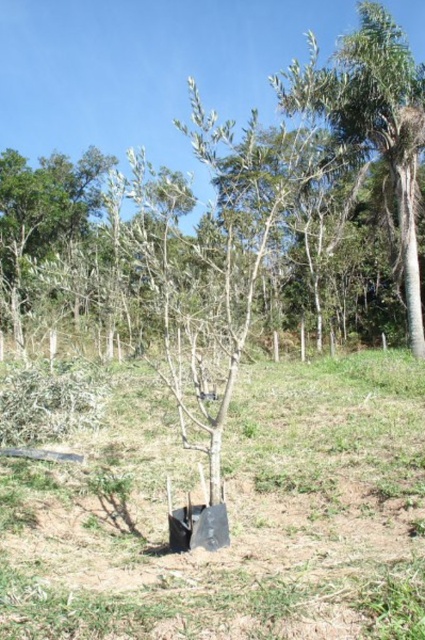
You are a gardener who wants to plant a new flowerbed between the green grass at center and the green leafy tree at upper center. Based on their widths, which area would you choose for the flowerbed?

The green grass at center has a lesser width compared to the green leafy tree at upper center, so the flowerbed should be placed where there is more space. Therefore, the area near the green leafy tree at upper center is better suited for the flowerbed due to its greater width.

You are a gardener who wants to plant a new shrub between the green grass at center and the green leafy tree at upper center. Based on their sizes, which one do you think you need to consider more when planning the space?

The green leafy tree at upper center is larger than the green grass at center, so you need to consider the space required for the green leafy tree at upper center more carefully when planning.

You are standing in the middle of the rural area and see the green grass at center and the green leafy tree at upper center. Which object is closer to you?

The green grass at center is closer to you because it is positioned below the green leafy tree at upper center, indicating it is in the foreground.